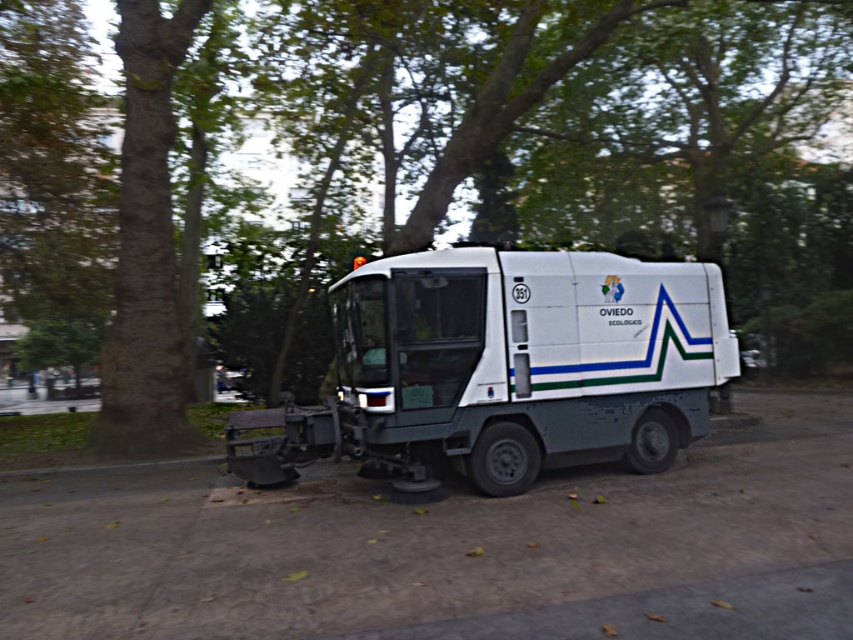
Which is above, green leafy tree at center or white matte tow truck at center?

green leafy tree at center is above.

Is green leafy tree at center to the left of white matte tow truck at center from the viewer's perspective?

Yes, green leafy tree at center is to the left of white matte tow truck at center.

Where is `green leafy tree at center`? green leafy tree at center is located at coordinates (541, 150).

The image size is (853, 640). Find the location of `green leafy tree at center`. green leafy tree at center is located at coordinates click(x=541, y=150).